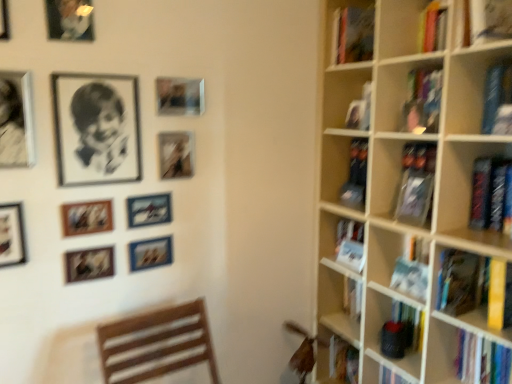
Question: In the image, is hardcover book at right, the first book in the bottom-to-top sequence, positioned in front of or behind metallic silver photo frame at center-left, arranged as the ninth picture frame when viewed from the top?

Choices:
 (A) front
 (B) behind

Answer: (A)

Question: From a real-world perspective, relative to metallic silver photo frame at center-left, arranged as the ninth picture frame when viewed from the top, is hardcover book at right, marked as the 4th book in a top-to-bottom arrangement, vertically above or below?

Choices:
 (A) above
 (B) below

Answer: (B)

Question: Based on their relative distances, which object is farther from the metallic silver airplane at upper left, arranged as the 6th picture frame when viewed from the top?

Choices:
 (A) black and white portrait at upper left
 (B) hardcover book at right, positioned as the third book in top-to-bottom order
 (C) metallic silver photo frame at center-left, arranged as the second picture frame when ordered from the bottom
 (D) matte black picture frame at lower left, arranged as the 10th picture frame when viewed from the top
 (E) matte black picture frame at upper center, the 6th picture frame from the bottom

Answer: (B)

Question: Based on their relative distances, which object is nearer to the hardcover books at right?

Choices:
 (A) metallic silver picture frame at upper left, which ranks as the 7th picture frame in bottom-to-top order
 (B) matte black picture frame at upper left, the 1th picture frame in the top-to-bottom sequence
 (C) matte black picture frame at lower left, marked as the 1th picture frame in a bottom-to-top arrangement
 (D) hardcover book at right, which is the second book in bottom-to-top order
 (E) hardcover book at right, marked as the 4th book in a top-to-bottom arrangement

Answer: (D)